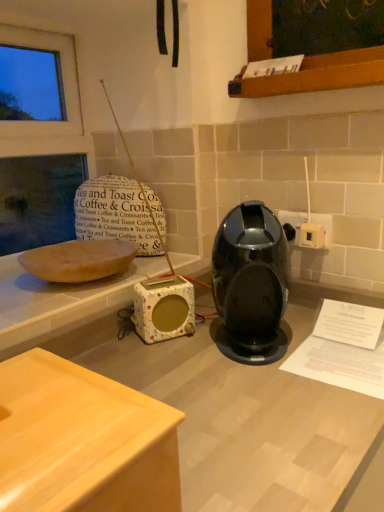
Question: From a real-world perspective, is glossy plastic coffee machine at center under white fabric-covered speaker at center?

Choices:
 (A) no
 (B) yes

Answer: (A)

Question: Is glossy plastic coffee machine at center shorter than white fabric-covered speaker at center?

Choices:
 (A) yes
 (B) no

Answer: (B)

Question: Is glossy plastic coffee machine at center next to white fabric-covered speaker at center and touching it?

Choices:
 (A) no
 (B) yes

Answer: (A)

Question: Would you say glossy plastic coffee machine at center is outside white fabric-covered speaker at center?

Choices:
 (A) yes
 (B) no

Answer: (A)

Question: From the image's perspective, is glossy plastic coffee machine at center on top of white fabric-covered speaker at center?

Choices:
 (A) yes
 (B) no

Answer: (A)

Question: In terms of width, does wooden at lower left look wider or thinner when compared to glossy plastic coffee machine at center?

Choices:
 (A) thin
 (B) wide

Answer: (A)

Question: Based on their sizes in the image, would you say wooden at lower left is bigger or smaller than glossy plastic coffee machine at center?

Choices:
 (A) small
 (B) big

Answer: (A)

Question: From a real-world perspective, relative to glossy plastic coffee machine at center, is wooden at lower left vertically above or below?

Choices:
 (A) below
 (B) above

Answer: (A)

Question: Is wooden at lower left taller or shorter than glossy plastic coffee machine at center?

Choices:
 (A) tall
 (B) short

Answer: (B)

Question: Relative to wooden at lower left, is glossy plastic coffee machine at center in front or behind?

Choices:
 (A) behind
 (B) front

Answer: (A)

Question: Visually, is glossy plastic coffee machine at center positioned to the left or to the right of wooden at lower left?

Choices:
 (A) left
 (B) right

Answer: (B)

Question: From their relative heights in the image, would you say glossy plastic coffee machine at center is taller or shorter than wooden at lower left?

Choices:
 (A) tall
 (B) short

Answer: (A)

Question: From the image's perspective, relative to wooden at lower left, is glossy plastic coffee machine at center above or below?

Choices:
 (A) below
 (B) above

Answer: (B)

Question: Is white fabric-covered speaker at center taller or shorter than white plastic electric outlet at right, arranged as the 2th electric outlet when viewed from the back?

Choices:
 (A) short
 (B) tall

Answer: (B)

Question: Is point (188, 296) positioned closer to the camera than point (302, 242)?

Choices:
 (A) closer
 (B) farther

Answer: (A)